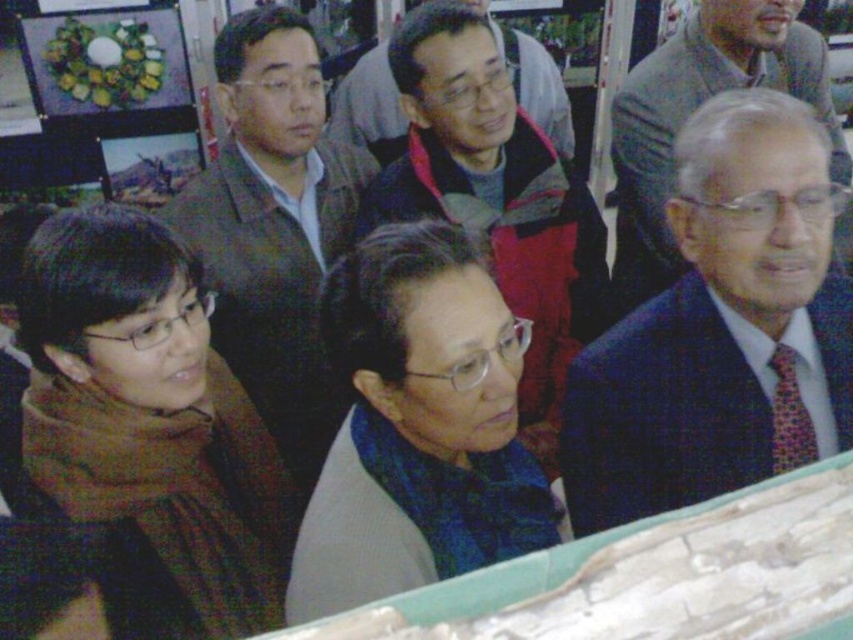
Question: Which object is farther from the camera taking this photo?

Choices:
 (A) blue fabric scarf at center
 (B) dark blue suit at center
 (C) dark blue suit at right
 (D) brown wool scarf at left

Answer: (B)

Question: Does dark blue suit at right have a larger size compared to matte black jacket at center?

Choices:
 (A) yes
 (B) no

Answer: (B)

Question: Which of the following is the closest to the observer?

Choices:
 (A) (422, 445)
 (B) (660, 387)

Answer: (A)

Question: In this image, where is dark blue suit at right located relative to matte black jacket at center?

Choices:
 (A) above
 (B) below

Answer: (B)

Question: Does dark blue suit at center appear on the right side of gray wool sweater at center?

Choices:
 (A) no
 (B) yes

Answer: (B)

Question: Estimate the real-world distances between objects in this image. Which object is closer to the dark blue suit at right?

Choices:
 (A) matte black jacket at center
 (B) gray wool sweater at center
 (C) matte brown suit at center

Answer: (A)